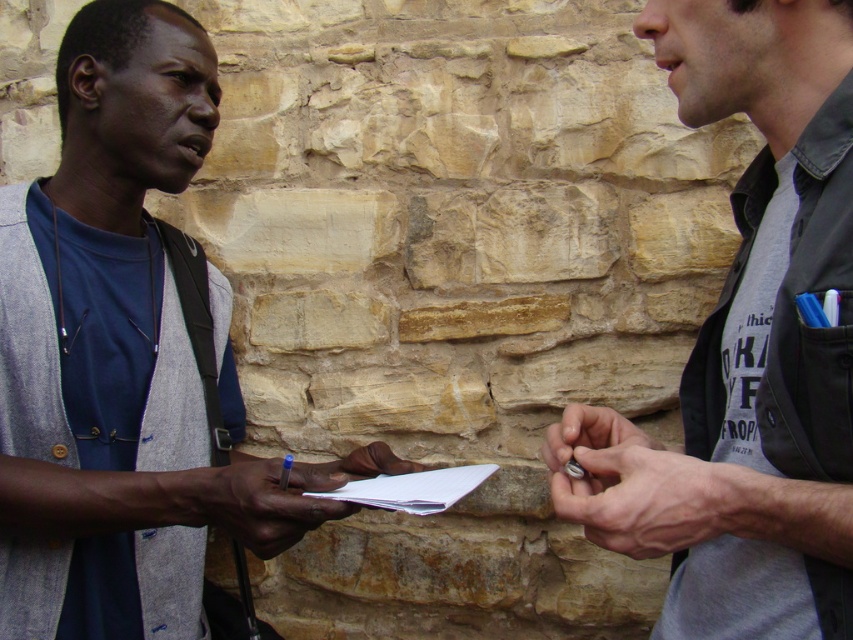
Question: Based on their relative distances, which object is nearer to the matte gray vest at left?

Choices:
 (A) gray fabric shirt at right
 (B) metallic silver ring at center

Answer: (B)

Question: Which point is farther from the camera taking this photo?

Choices:
 (A) (433, 470)
 (B) (102, 99)
 (C) (201, 500)

Answer: (A)

Question: Can you confirm if gray fabric shirt at right is smaller than white paper at center?

Choices:
 (A) yes
 (B) no

Answer: (B)

Question: Does matte gray vest at left lie in front of gray fabric shirt at right?

Choices:
 (A) yes
 (B) no

Answer: (B)

Question: Can you confirm if gray fabric shirt at right is positioned to the right of metallic silver ring at center?

Choices:
 (A) yes
 (B) no

Answer: (A)

Question: Which point appears closest to the camera in this image?

Choices:
 (A) (189, 120)
 (B) (358, 492)
 (C) (715, 470)

Answer: (C)